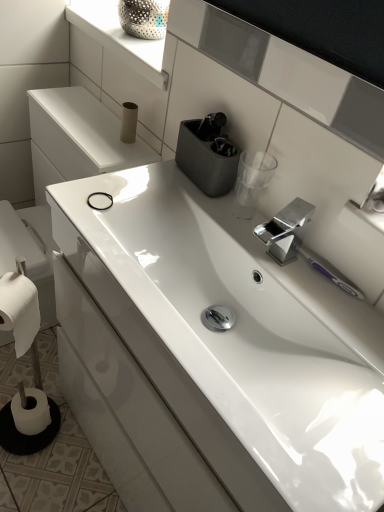
Where is `free space in front of polished metallic tap at center`? Image resolution: width=384 pixels, height=512 pixels. free space in front of polished metallic tap at center is located at coordinates (301, 308).